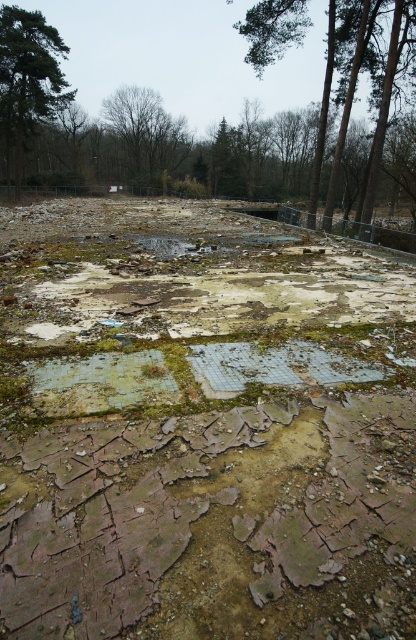
Question: Is brown wood tree at upper center to the right of green leafy tree at upper left from the viewer's perspective?

Choices:
 (A) no
 (B) yes

Answer: (B)

Question: Does brown wood tree at upper center lie in front of green leafy tree at upper left?

Choices:
 (A) no
 (B) yes

Answer: (B)

Question: Which of the following is the farthest from the observer?

Choices:
 (A) (47, 83)
 (B) (109, 116)

Answer: (B)

Question: Does green leafy tree at upper left appear on the right side of brown leafless tree at upper center?

Choices:
 (A) yes
 (B) no

Answer: (B)

Question: Among these points, which one is farthest from the camera?

Choices:
 (A) (121, 148)
 (B) (324, 129)
 (C) (47, 35)

Answer: (A)

Question: Which point is farther to the camera?

Choices:
 (A) green leafy tree at upper left
 (B) brown leafless tree at upper center

Answer: (B)